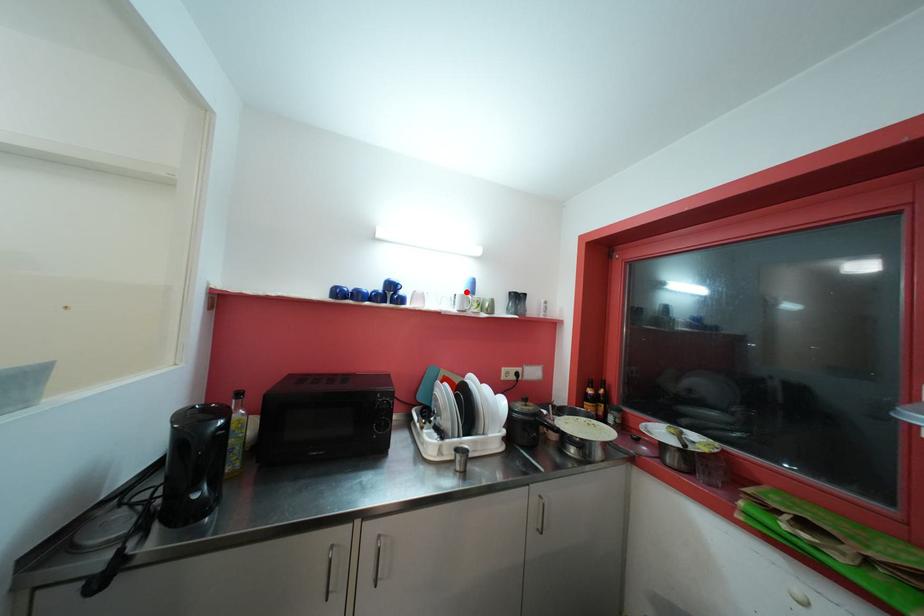
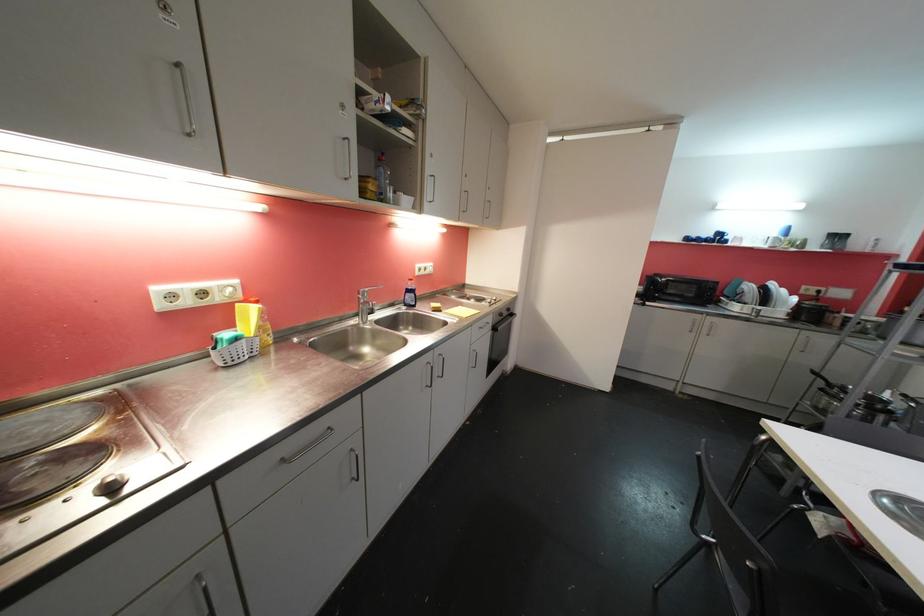
The point at the highlighted location is marked in the first image. Where is the corresponding point in the second image?

(781, 236)